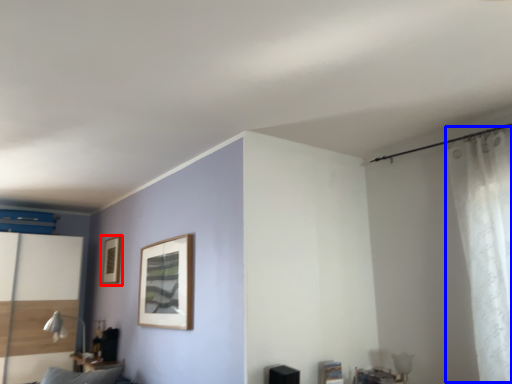
Question: Which point is closer to the camera, picture frame (highlighted by a red box) or curtain (highlighted by a blue box)?

Choices:
 (A) picture frame
 (B) curtain

Answer: (B)